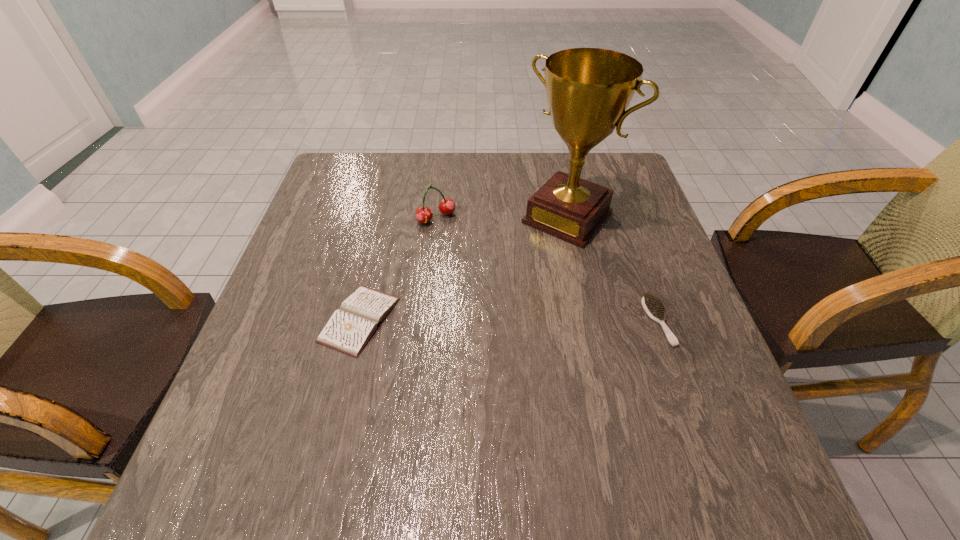
The height and width of the screenshot is (540, 960). I want to click on vacant spot on the desktop that is between the leftmost object and the third tallest object and is positioned on the plaque of the tallest object, so click(x=473, y=320).

Locate an element on the screen. vacant space on the desktop that is between the diary and the scrubbing brush and is positioned with stems pointing upwards on the third object from right to left is located at coordinates (517, 321).